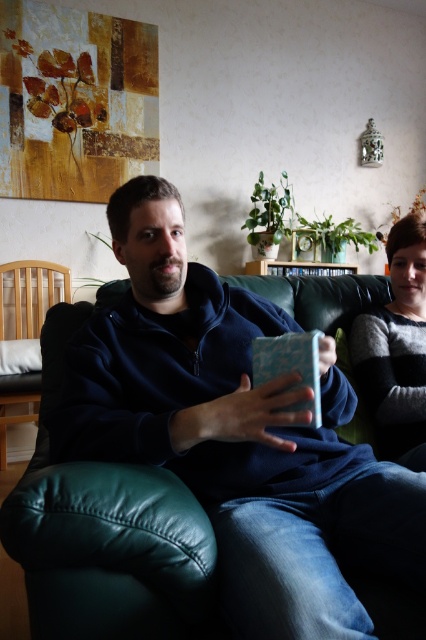
Question: Is the position of green leather couch at center less distant than that of striped sweater at right?

Choices:
 (A) yes
 (B) no

Answer: (A)

Question: Is green leather couch at center thinner than striped sweater at right?

Choices:
 (A) no
 (B) yes

Answer: (A)

Question: Which of the following is the closest to the observer?

Choices:
 (A) (40, 540)
 (B) (26, 298)

Answer: (A)

Question: Is the position of green leather couch at center less distant than that of striped sweater at right?

Choices:
 (A) no
 (B) yes

Answer: (B)

Question: Among these points, which one is nearest to the camera?

Choices:
 (A) (20, 346)
 (B) (241, 282)
 (C) (356, 364)

Answer: (C)

Question: Which point is closer to the camera?

Choices:
 (A) (x=399, y=460)
 (B) (x=39, y=372)

Answer: (A)